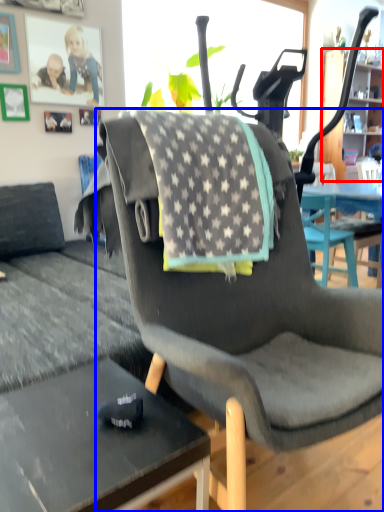
Question: Which object is closer to the camera taking this photo, cabinetry (highlighted by a red box) or chair (highlighted by a blue box)?

Choices:
 (A) cabinetry
 (B) chair

Answer: (B)